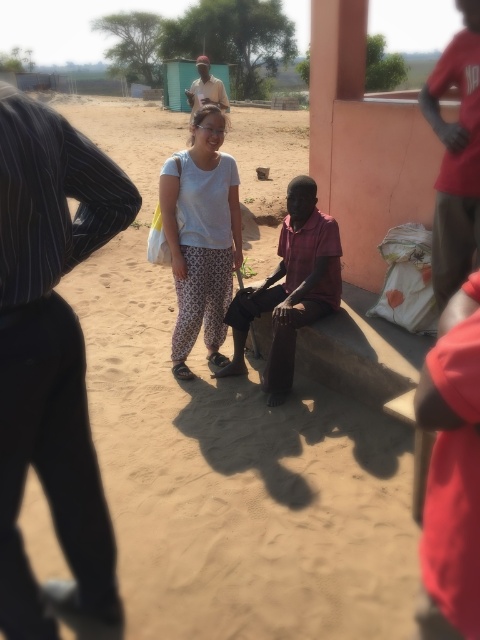
Who is positioned more to the left, white cotton shirt at center or dark red fabric shirt at center?

white cotton shirt at center is more to the left.

Does white cotton shirt at center have a lesser height compared to dark red fabric shirt at center?

No, white cotton shirt at center is not shorter than dark red fabric shirt at center.

I want to click on white cotton shirt at center, so click(202, 236).

Identify the location of white cotton shirt at center. This screenshot has width=480, height=640. 202,236.

Which is above, black striped shirt at left or white cotton shirt at center?

Positioned higher is white cotton shirt at center.

Is black striped shirt at left shorter than white cotton shirt at center?

In fact, black striped shirt at left may be taller than white cotton shirt at center.

You are a GUI agent. You are given a task and a screenshot of the screen. Output one action in this format:
    pyautogui.click(x=<x>, y=<y>)
    Task: Click on the black striped shirt at left
    The width and height of the screenshot is (480, 640).
    Given the screenshot: What is the action you would take?
    pyautogui.click(x=50, y=355)

Is dark red fabric shirt at center below red cotton shirt at right?

Yes, dark red fabric shirt at center is below red cotton shirt at right.

Is dark red fabric shirt at center to the right of red cotton shirt at right from the viewer's perspective?

Incorrect, dark red fabric shirt at center is not on the right side of red cotton shirt at right.

Who is more distant from viewer, (285,301) or (468,170)?

The point (285,301) is behind.

What are the coordinates of `dark red fabric shirt at center` in the screenshot? It's located at (x=289, y=289).